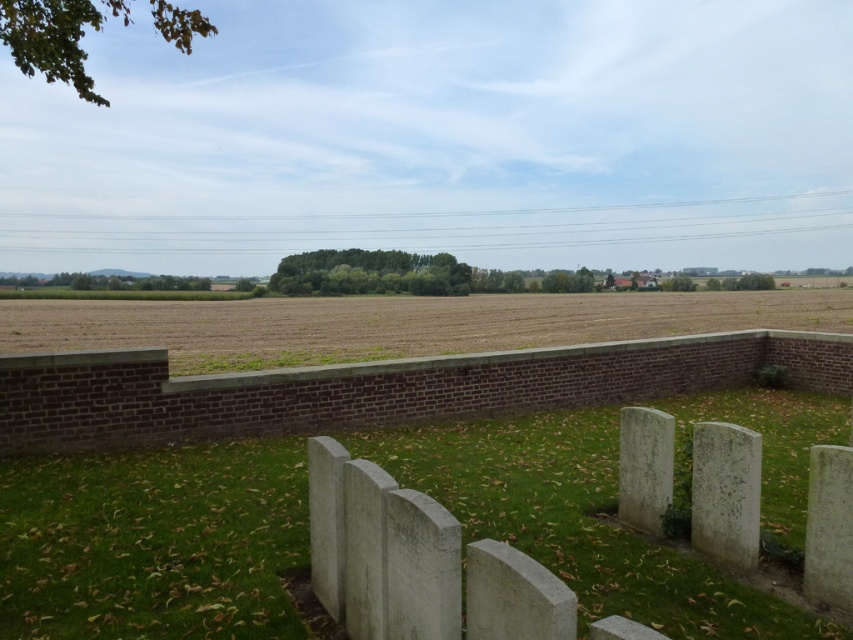
Which of these two, brown grassland at lower center or white stone gravestone at right, stands taller?

brown grassland at lower center

Identify the location of brown grassland at lower center. (397, 323).

Which of these two, brown grassland at lower center or gray stone gravestone at lower right, stands shorter?

Standing shorter between the two is gray stone gravestone at lower right.

Is brown grassland at lower center wider than gray stone gravestone at lower right?

Yes, brown grassland at lower center is wider than gray stone gravestone at lower right.

Find the location of a particular element. The height and width of the screenshot is (640, 853). brown grassland at lower center is located at coordinates (x=397, y=323).

Locate an element on the screen. brown grassland at lower center is located at coordinates (397, 323).

Is white stone gravestone at right behind gray stone gravestone at lower right?

Yes, it is.

Describe the element at coordinates (724, 492) in the screenshot. Image resolution: width=853 pixels, height=640 pixels. I see `white stone gravestone at right` at that location.

At what (x,y) coordinates should I click in order to perform the action: click on white stone gravestone at right. Please return your answer as a coordinate pair (x, y). Looking at the image, I should click on (724, 492).